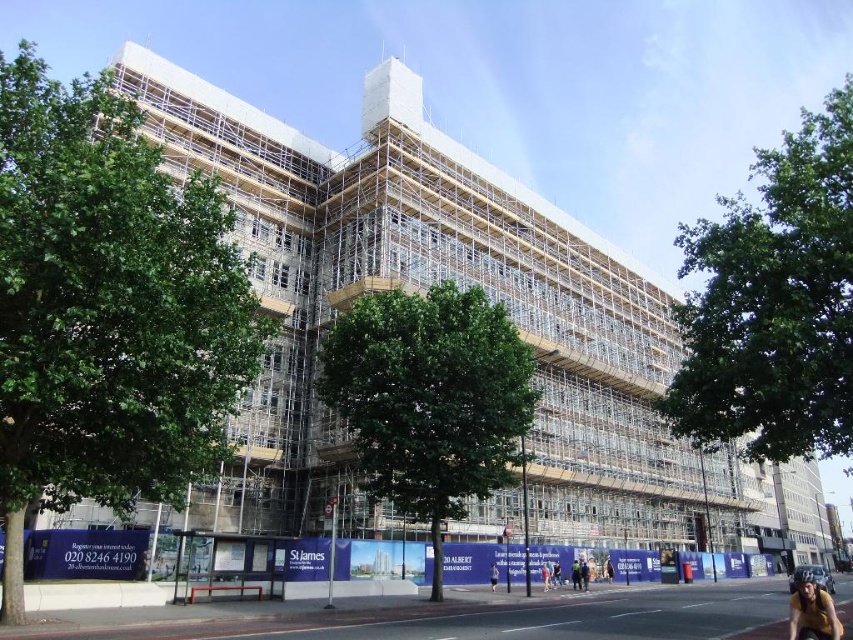
Which is more to the left, green leafy tree at left or green leafy tree at upper right?

green leafy tree at left

Which is behind, point (161, 198) or point (814, 132)?

Positioned behind is point (814, 132).

The height and width of the screenshot is (640, 853). I want to click on green leafy tree at left, so click(x=107, y=308).

Locate an element on the screen. green leafy tree at left is located at coordinates (107, 308).

Is point (805, 316) closer to camera compared to point (444, 364)?

Yes.

Based on the photo, who is lower down, green leafy tree at upper right or green leafy tree at center?

green leafy tree at center is below.

Locate an element on the screen. The image size is (853, 640). green leafy tree at upper right is located at coordinates (775, 301).

Does green leafy tree at left have a smaller size compared to green leafy tree at center?

No.

Locate an element on the screen. This screenshot has height=640, width=853. green leafy tree at left is located at coordinates (107, 308).

The width and height of the screenshot is (853, 640). I want to click on green leafy tree at left, so click(107, 308).